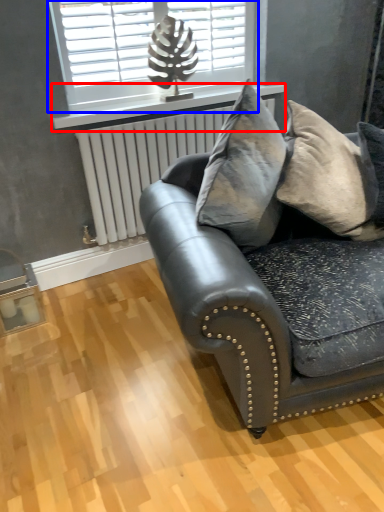
Question: Which object appears closest to the camera in this image, window sill (highlighted by a red box) or window (highlighted by a blue box)?

Choices:
 (A) window sill
 (B) window

Answer: (B)